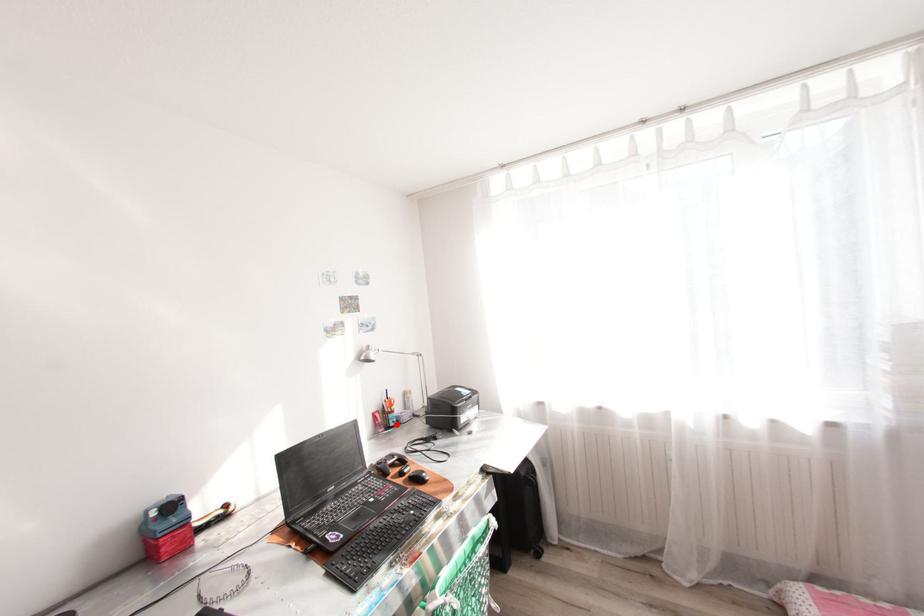
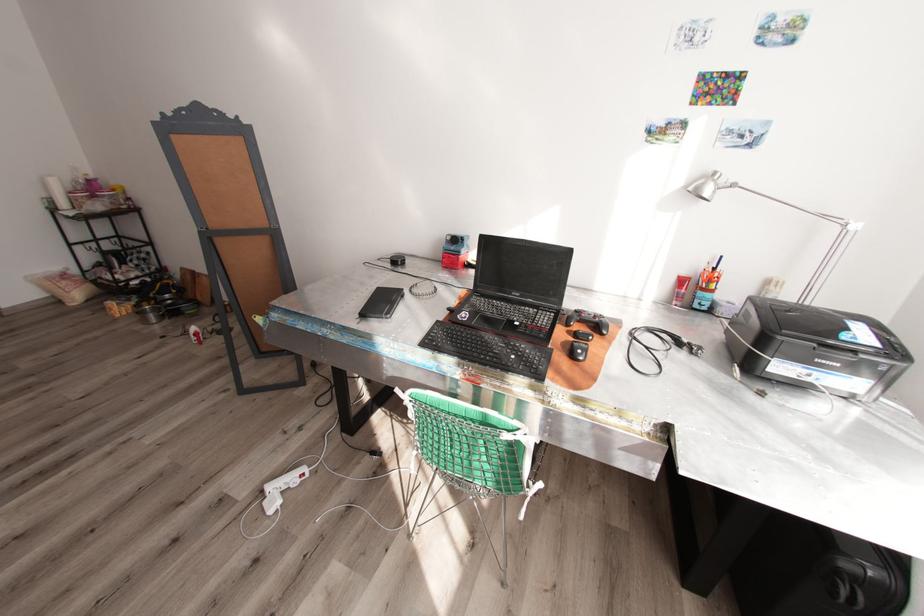
The point at the highlighted location is marked in the first image. Where is the corresponding point in the second image?

(699, 305)